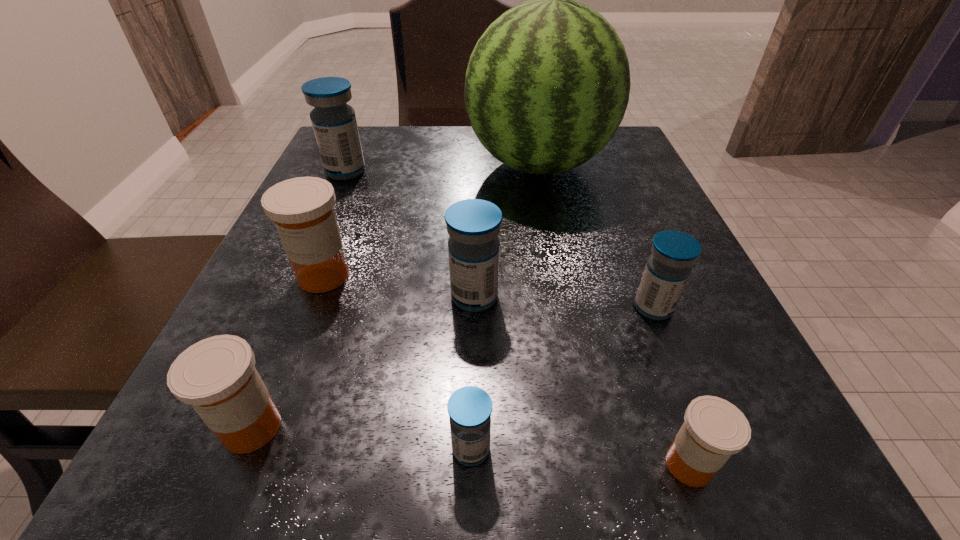
At what (x,y) coordinates should I click in order to perform the action: click on the tallest object. Please return your answer as a coordinate pair (x, y). This screenshot has width=960, height=540. Looking at the image, I should click on (547, 85).

In order to click on green watermelon in this screenshot , I will do `click(547, 85)`.

The image size is (960, 540). I want to click on the leftmost blue medicine, so click(x=334, y=123).

Find the location of a particular element. This screenshot has height=540, width=960. the farthest blue medicine is located at coordinates (334, 123).

In order to click on the biggest orange medicine in this screenshot , I will do `click(302, 209)`.

Where is `the third smallest blue medicine`? The image size is (960, 540). the third smallest blue medicine is located at coordinates (473, 225).

You are a GUI agent. You are given a task and a screenshot of the screen. Output one action in this format:
    pyautogui.click(x=<x>, y=<y>)
    Task: Click on the rightmost blue medicine
    The image size is (960, 540).
    Given the screenshot: What is the action you would take?
    pyautogui.click(x=667, y=270)

I want to click on the second smallest orange medicine, so click(217, 376).

At what (x,y) coordinates should I click in order to perform the action: click on the nearest blue medicine. Please return your answer as a coordinate pair (x, y). This screenshot has height=540, width=960. Looking at the image, I should click on (470, 407).

At what (x,y) coordinates should I click in order to perform the action: click on the rightmost orange medicine. Please return your answer as a coordinate pair (x, y). The image size is (960, 540). Looking at the image, I should click on (713, 429).